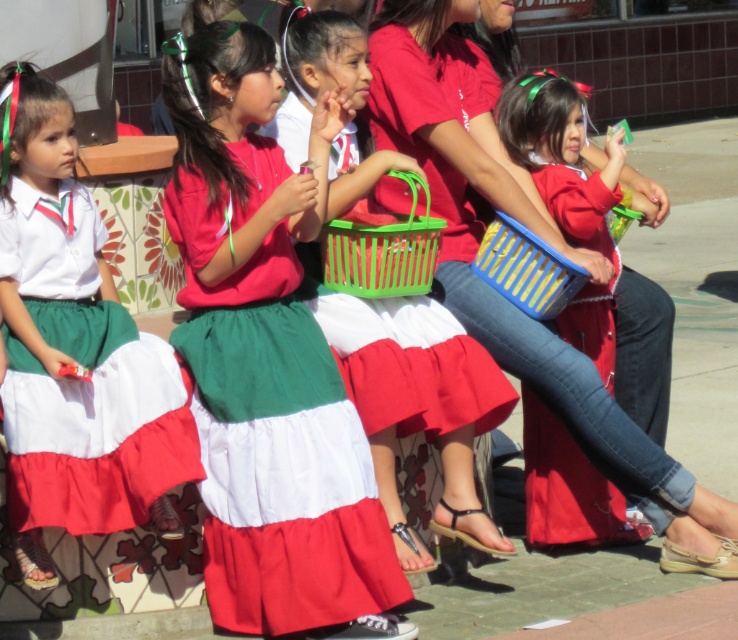
Between green cotton skirt at left and blue plastic basket at center, which one appears on the right side from the viewer's perspective?

blue plastic basket at center is more to the right.

Is point (44, 452) more distant than point (568, 259)?

No.

The image size is (738, 640). I want to click on green cotton skirt at left, so click(93, 419).

Can you confirm if matte red skirt at center is thinner than green plastic basket at center?

No.

In the scene shown: Between matte red skirt at center and green plastic basket at center, which one is positioned lower?

matte red skirt at center

Is point (618, 202) closer to camera compared to point (399, 173)?

No, it is not.

At what (x,y) coordinates should I click in order to perform the action: click on matte red skirt at center. Please return your answer as a coordinate pair (x, y). The width and height of the screenshot is (738, 640). Looking at the image, I should click on (590, 246).

Which is behind, point (251, 372) or point (83, 522)?

The point (251, 372) is behind.

From the picture: Can you confirm if green cotton skirt at center is positioned to the left of green cotton skirt at left?

In fact, green cotton skirt at center is to the right of green cotton skirt at left.

Is point (210, 460) closer to viewer compared to point (114, 410)?

No, it is behind (114, 410).

You are a GUI agent. You are given a task and a screenshot of the screen. Output one action in this format:
    pyautogui.click(x=<x>, y=<y>)
    Task: Click on the green cotton skirt at center
    
    Given the screenshot: What is the action you would take?
    pyautogui.click(x=272, y=426)